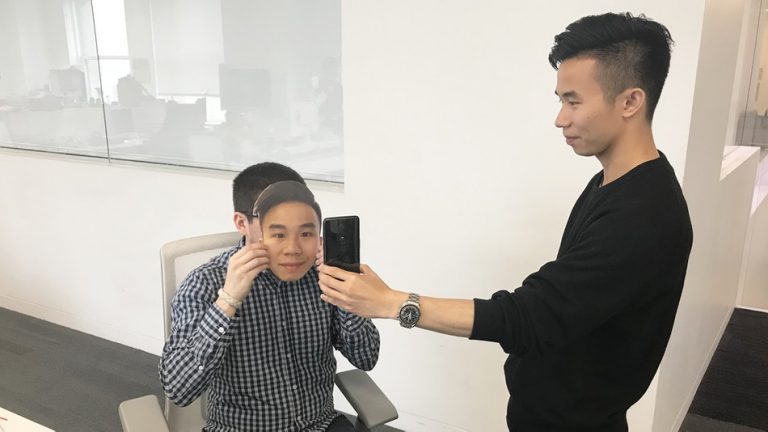
Locate an element on the screen. The width and height of the screenshot is (768, 432). floor is located at coordinates (96, 359), (740, 399).